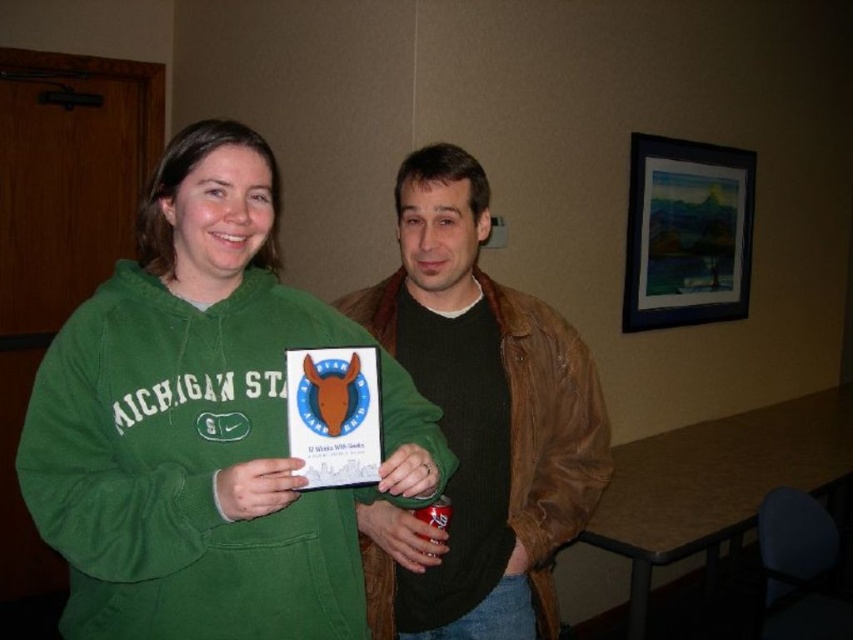
Question: Which of the following is the closest to the observer?

Choices:
 (A) (519, 372)
 (B) (305, 314)

Answer: (B)

Question: Is green fleece sweatshirt at center in front of brown leather jacket at center?

Choices:
 (A) yes
 (B) no

Answer: (A)

Question: Can you confirm if green fleece sweatshirt at center is positioned to the left of brown leather jacket at center?

Choices:
 (A) no
 (B) yes

Answer: (B)

Question: Does green fleece sweatshirt at center have a larger size compared to brown leather jacket at center?

Choices:
 (A) no
 (B) yes

Answer: (A)